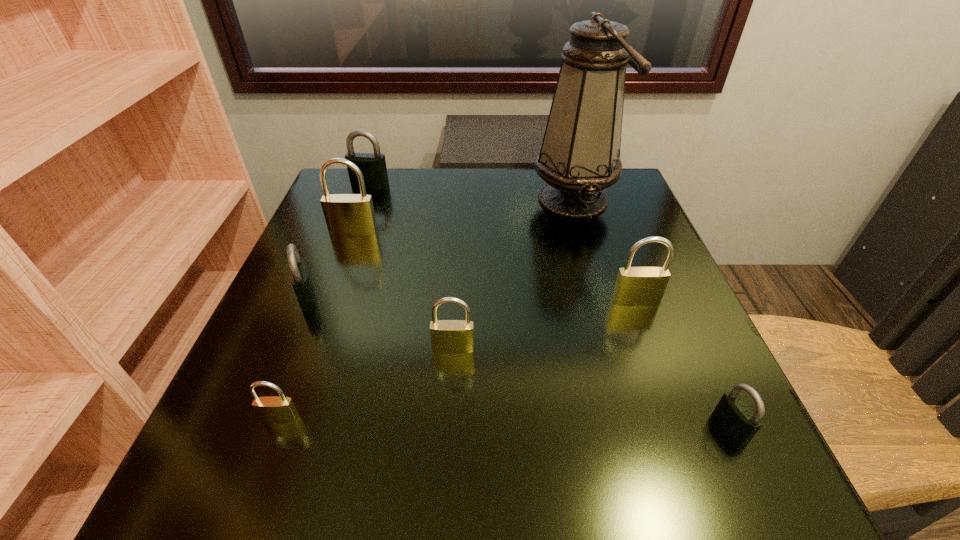
The image size is (960, 540). Identify the location of blank space at the left edge of the desktop. (300, 443).

Find the location of a particular element. The width and height of the screenshot is (960, 540). vacant space at the right edge of the desktop is located at coordinates (679, 281).

In order to click on vacant point at the near left corner in this screenshot , I will do `click(243, 469)`.

Locate an element on the screen. The image size is (960, 540). free space at the near right corner of the desktop is located at coordinates (733, 480).

Find the location of `free point between the nearest black padlock and the nearest brass padlock`. free point between the nearest black padlock and the nearest brass padlock is located at coordinates (505, 423).

Image resolution: width=960 pixels, height=540 pixels. I want to click on vacant space that's between the smallest brass padlock and the second farthest brass padlock, so click(x=458, y=360).

This screenshot has height=540, width=960. I want to click on unoccupied position between the biggest black padlock and the brown oil lamp, so click(x=471, y=192).

You are a GUI agent. You are given a task and a screenshot of the screen. Output one action in this format:
    pyautogui.click(x=<x>, y=<y>)
    Task: Click on the vacant region between the nearest brass padlock and the rightmost brass padlock
    
    Given the screenshot: What is the action you would take?
    pyautogui.click(x=458, y=360)

Image resolution: width=960 pixels, height=540 pixels. Identify the location of vacant area that lies between the nearest brass padlock and the biggest brass padlock. (317, 325).

You are a GUI agent. You are given a task and a screenshot of the screen. Output one action in this format:
    pyautogui.click(x=<x>, y=<y>)
    Task: Click on the vacant area that lies between the tallest object and the third brass padlock from left to right
    The image size is (960, 540).
    Given the screenshot: What is the action you would take?
    pyautogui.click(x=513, y=274)